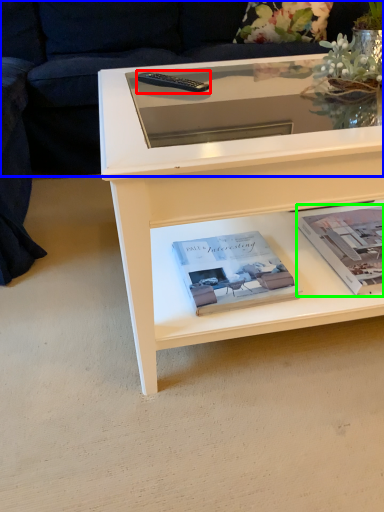
Question: Based on their relative distances, which object is nearer to remote (highlighted by a red box)? Choose from couch (highlighted by a blue box) and paperback book (highlighted by a green box).

Choices:
 (A) couch
 (B) paperback book

Answer: (B)